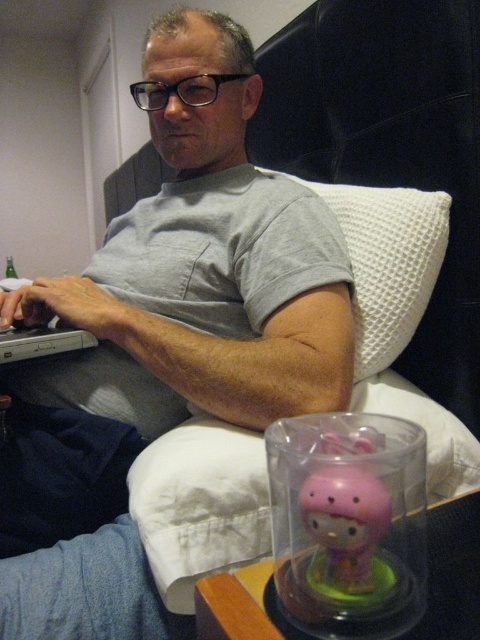
Question: Among these points, which one is farthest from the camera?

Choices:
 (A) (148, 84)
 (B) (373, 584)

Answer: (A)

Question: Which point is farther from the camera taking this photo?

Choices:
 (A) (364, 202)
 (B) (267, 216)

Answer: (A)

Question: Can you confirm if gray cotton shirt at upper center is positioned above pink plastic piggy bank at lower right?

Choices:
 (A) no
 (B) yes

Answer: (B)

Question: Can you confirm if gray cotton shirt at upper center is smaller than pink plastic piggy bank at lower right?

Choices:
 (A) no
 (B) yes

Answer: (A)

Question: Among these objects, which one is farthest from the camera?

Choices:
 (A) gray cotton shirt at upper center
 (B) white waffle-textured pillow at upper right
 (C) pink plastic piggy bank at lower right

Answer: (B)

Question: Observing the image, what is the correct spatial positioning of gray cotton shirt at upper center in reference to white waffle-textured pillow at upper right?

Choices:
 (A) left
 (B) right

Answer: (A)